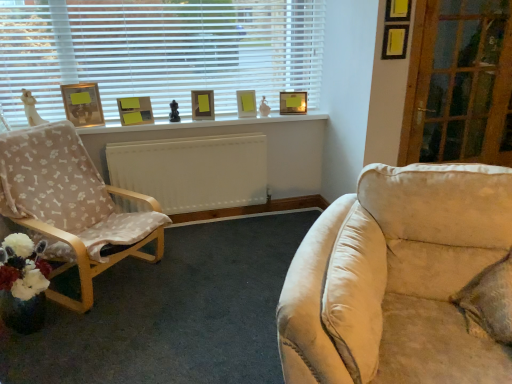
Identify the location of free spot below white plastic blinds at upper left (from a real-world perspective). (216, 114).